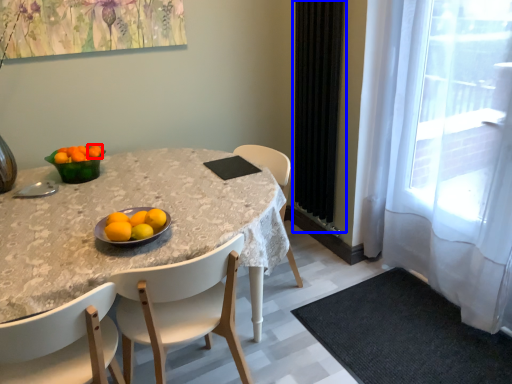
Question: Which of the following is the closest to the observer, tangerine (highlighted by a red box) or curtain (highlighted by a blue box)?

Choices:
 (A) tangerine
 (B) curtain

Answer: (A)